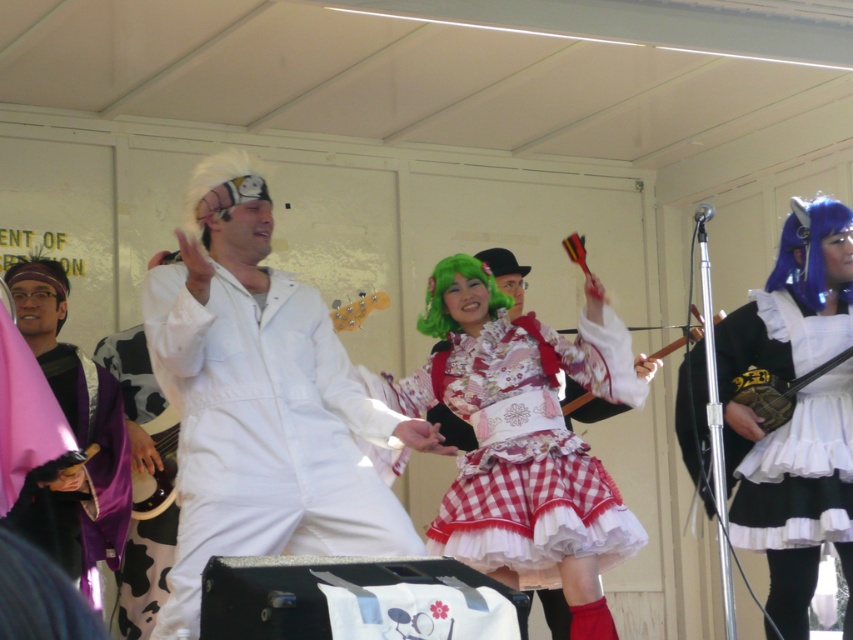
You are a photographer positioned behind the white matte jumpsuit at center and the purple velvet robe at left. To capture both subjects in focus, which one should you adjust your camera to prioritize focusing on first?

The white matte jumpsuit at center is in front of the purple velvet robe at left, so you should prioritize focusing on the white matte jumpsuit at center first to ensure both are in focus.

You are standing at the entrance of the tent and want to approach the performer in the white matte jumpsuit at center. Which direction should you move to reach them?

The white matte jumpsuit at center is located at point (262, 401), so you should move towards the center of the tent to reach them.